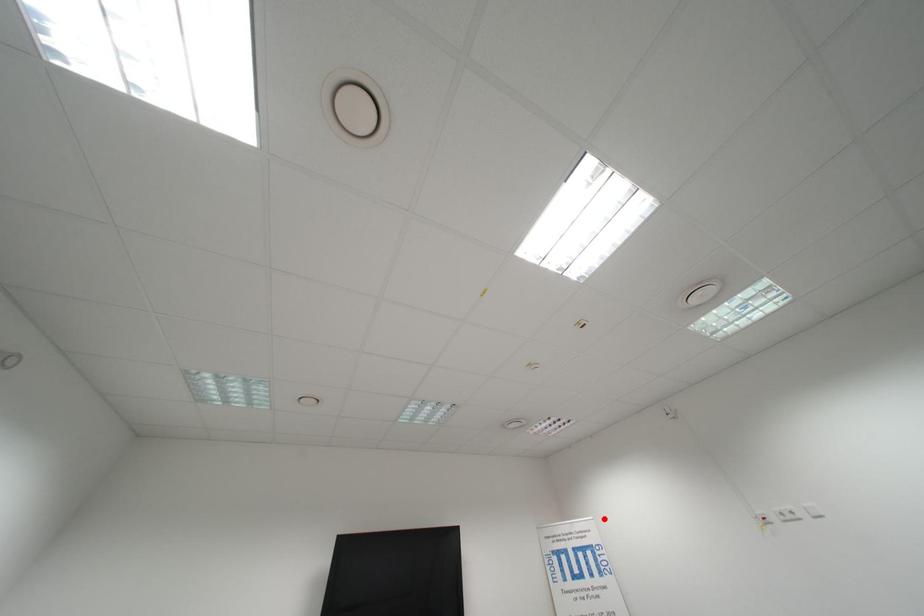
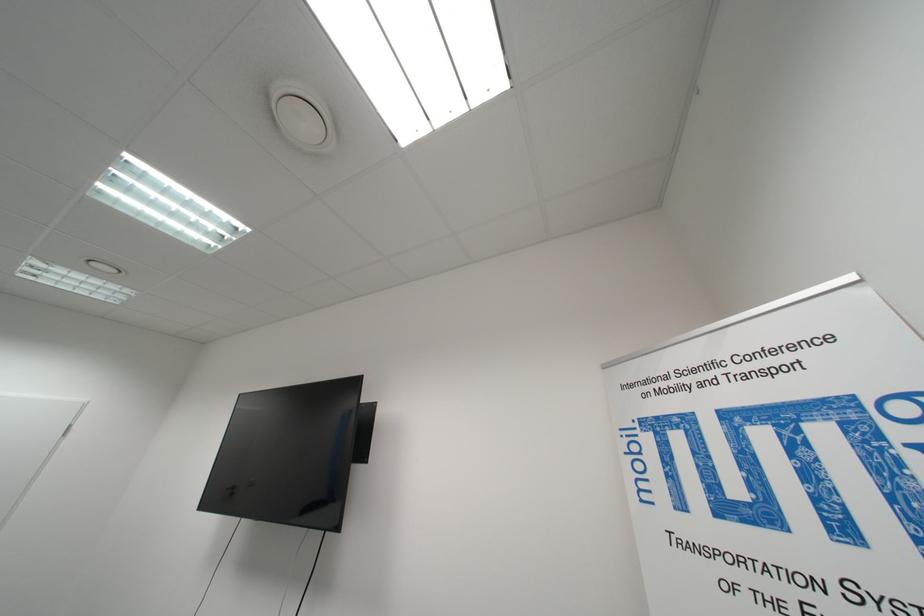
The point at the highlighted location is marked in the first image. Where is the corresponding point in the second image?

(861, 278)